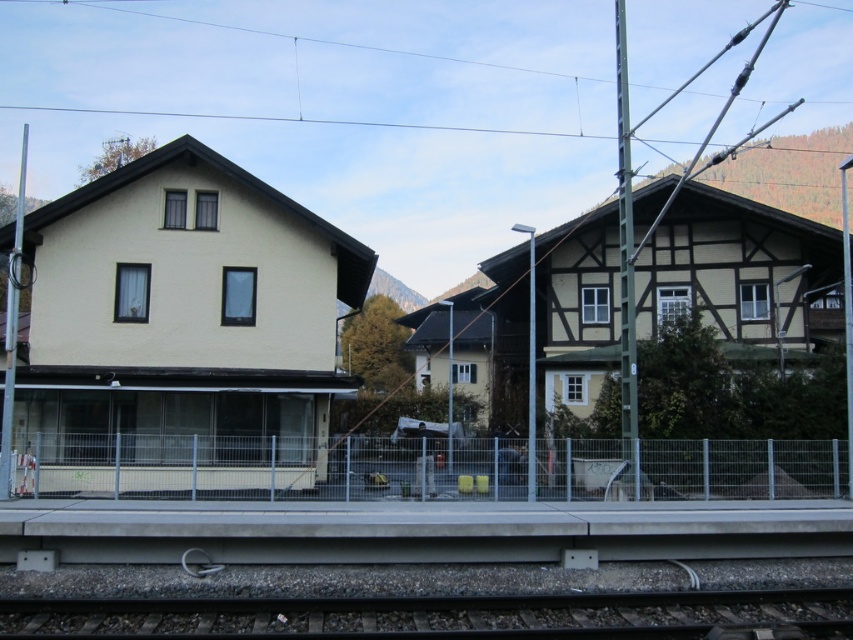
Question: Which of the following is the farthest from the observer?

Choices:
 (A) matte yellow building at center
 (B) gray metal rail at center
 (C) smooth metal train track at lower center

Answer: (B)

Question: From the image, what is the correct spatial relationship of matte yellow building at center in relation to smooth metal train track at lower center?

Choices:
 (A) above
 (B) below

Answer: (A)

Question: Can you confirm if matte yellow building at center is positioned to the left of smooth metal train track at lower center?

Choices:
 (A) no
 (B) yes

Answer: (B)

Question: Estimate the real-world distances between objects in this image. Which object is farther from the gray metal rail at center?

Choices:
 (A) smooth metal train track at lower center
 (B) matte yellow building at center

Answer: (A)

Question: Is gray metal rail at center smaller than smooth metal train track at lower center?

Choices:
 (A) yes
 (B) no

Answer: (B)

Question: Which object appears closest to the camera in this image?

Choices:
 (A) matte yellow building at center
 (B) smooth metal train track at lower center
 (C) gray metal rail at center

Answer: (B)